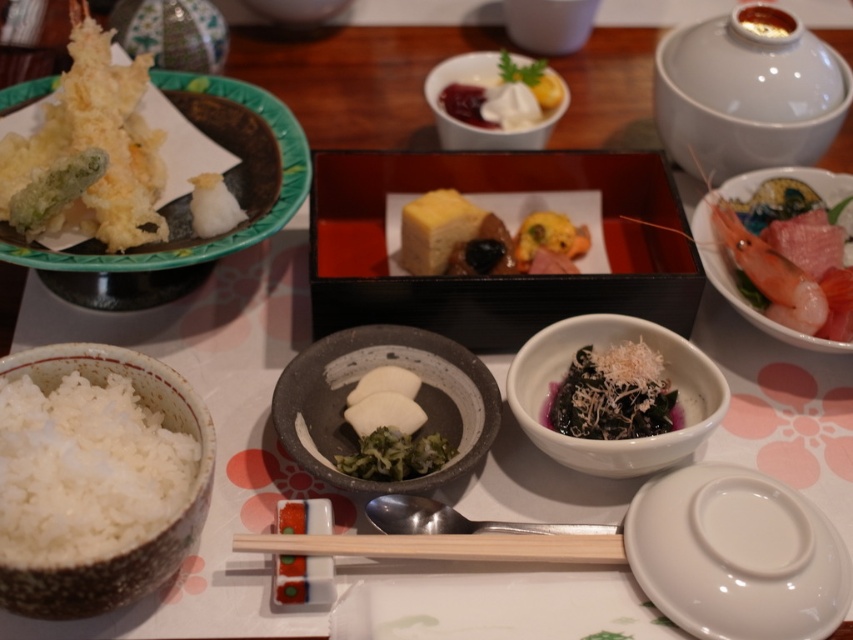
You are a food critic reviewing this Japanese meal. You notice the yellow cheese at center and the pink glossy shrimp at right on the table. Which of these two items is smaller in size?

The yellow cheese at center has a smaller size compared to the pink glossy shrimp at right, so the yellow cheese at center is the smaller one.

You are a photographer trying to capture the Japanese meal setup. You notice two points marked in the image. Which point, point (699,298) or point (485,141), is closer to your camera lens?

Point (699,298) is closer to the camera than point (485,141).

You are a guest at a Japanese restaurant and want to place your chopsticks on the black lacquered tray at center. However, you notice the white ceramic bowl at upper center is in the way. Can you move the chopsticks to the tray without disturbing the bowl?

The black lacquered tray at center is located below the white ceramic bowl at upper center, so you can move the chopsticks to the tray by placing them underneath the bowl without disturbing it.